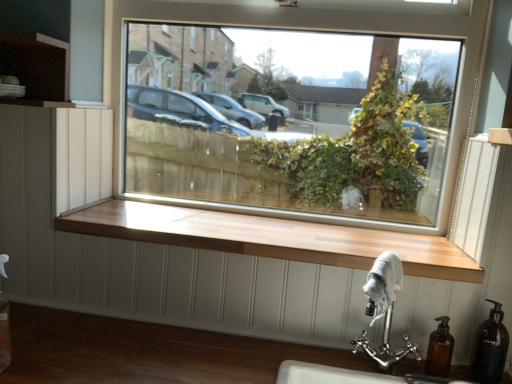
Locate an element on the screen. The height and width of the screenshot is (384, 512). brown matte soap dispenser at lower right, the 2th soap dispenser when ordered from right to left is located at coordinates (439, 350).

At what (x,y) coordinates should I click in order to perform the action: click on polished chrome sink at lower right. Please return your answer as a coordinate pair (x, y). Looking at the image, I should click on (384, 310).

In order to face transparent glass window at center, should I rotate leftwards or rightwards?

You should rotate right by 3.357 degrees.

Where is `wooden at center`? This screenshot has height=384, width=512. wooden at center is located at coordinates (269, 237).

Find the location of a particular element. The height and width of the screenshot is (384, 512). brown matte soap dispenser at lower right, the 1th soap dispenser positioned from the left is located at coordinates (439, 350).

Is wooden at center positioned before transparent glass window at center?

Yes, it is in front of transparent glass window at center.

Considering the positions of points (70, 232) and (464, 55), is point (70, 232) farther from camera compared to point (464, 55)?

No, it is not.

Is wooden at center oriented towards transparent glass window at center?

No, wooden at center is not facing towards transparent glass window at center.

From the image's perspective, is translucent brown soap dispenser at lower right, which is the first soap dispenser in right-to-left order, on wooden at center?

Incorrect, from the image's perspective, translucent brown soap dispenser at lower right, which is the first soap dispenser in right-to-left order, is lower than wooden at center.

From a real-world perspective, is translucent brown soap dispenser at lower right, the second soap dispenser from the left, physically below wooden at center?

Correct, in the physical world, translucent brown soap dispenser at lower right, the second soap dispenser from the left, is lower than wooden at center.

Would you consider translucent brown soap dispenser at lower right, the second soap dispenser from the left, to be distant from wooden at center?

translucent brown soap dispenser at lower right, the second soap dispenser from the left, is near wooden at center, not far away.

From the picture: How far apart are translucent brown soap dispenser at lower right, the second soap dispenser from the left, and wooden at center?

translucent brown soap dispenser at lower right, the second soap dispenser from the left, is 19.82 inches away from wooden at center.

Is translucent brown soap dispenser at lower right, the second soap dispenser from the left, oriented towards brown matte soap dispenser at lower right, the 2th soap dispenser when ordered from right to left?

No.

From the image's perspective, which one is positioned higher, translucent brown soap dispenser at lower right, which is the first soap dispenser in right-to-left order, or brown matte soap dispenser at lower right, the 1th soap dispenser positioned from the left?

translucent brown soap dispenser at lower right, which is the first soap dispenser in right-to-left order, appears higher in the image.

Based on the photo, considering the relative sizes of translucent brown soap dispenser at lower right, which is the first soap dispenser in right-to-left order, and brown matte soap dispenser at lower right, the 2th soap dispenser when ordered from right to left, in the image provided, is translucent brown soap dispenser at lower right, which is the first soap dispenser in right-to-left order, thinner than brown matte soap dispenser at lower right, the 2th soap dispenser when ordered from right to left,?

No.

How far apart are translucent brown soap dispenser at lower right, the second soap dispenser from the left, and brown matte soap dispenser at lower right, the 1th soap dispenser positioned from the left?

translucent brown soap dispenser at lower right, the second soap dispenser from the left, and brown matte soap dispenser at lower right, the 1th soap dispenser positioned from the left, are 4.37 inches apart.

Is there a large distance between polished chrome sink at lower right and brown matte soap dispenser at lower right, the 1th soap dispenser positioned from the left?

No, polished chrome sink at lower right is in close proximity to brown matte soap dispenser at lower right, the 1th soap dispenser positioned from the left.

Does polished chrome sink at lower right contain brown matte soap dispenser at lower right, the 2th soap dispenser when ordered from right to left?

No, brown matte soap dispenser at lower right, the 2th soap dispenser when ordered from right to left, is not a part of polished chrome sink at lower right.

Looking at this image, considering the relative sizes of polished chrome sink at lower right and brown matte soap dispenser at lower right, the 2th soap dispenser when ordered from right to left, in the image provided, is polished chrome sink at lower right shorter than brown matte soap dispenser at lower right, the 2th soap dispenser when ordered from right to left,?

Incorrect, the height of polished chrome sink at lower right does not fall short of that of brown matte soap dispenser at lower right, the 2th soap dispenser when ordered from right to left.

How different are the orientations of polished chrome sink at lower right and brown matte soap dispenser at lower right, the 1th soap dispenser positioned from the left, in degrees?

polished chrome sink at lower right and brown matte soap dispenser at lower right, the 1th soap dispenser positioned from the left, are facing 1.78 degrees away from each other.

From a real-world perspective, is translucent brown soap dispenser at lower right, which is the first soap dispenser in right-to-left order, above or below polished chrome sink at lower right?

Clearly, from a real-world perspective, translucent brown soap dispenser at lower right, which is the first soap dispenser in right-to-left order, is below polished chrome sink at lower right.

Is translucent brown soap dispenser at lower right, which is the first soap dispenser in right-to-left order, not near polished chrome sink at lower right?

No, translucent brown soap dispenser at lower right, which is the first soap dispenser in right-to-left order, is in close proximity to polished chrome sink at lower right.

Find the location of a particular element. The height and width of the screenshot is (384, 512). the 1st soap dispenser positioned below the polished chrome sink at lower right (from a real-world perspective) is located at coordinates (490, 348).

Choose the correct answer: Is translucent brown soap dispenser at lower right, the second soap dispenser from the left, inside polished chrome sink at lower right or outside it?

translucent brown soap dispenser at lower right, the second soap dispenser from the left, exists outside the volume of polished chrome sink at lower right.

Does brown matte soap dispenser at lower right, the 2th soap dispenser when ordered from right to left, have a greater height compared to polished chrome sink at lower right?

No.

From a real-world perspective, relative to polished chrome sink at lower right, is brown matte soap dispenser at lower right, the 1th soap dispenser positioned from the left, vertically above or below?

From a real-world perspective, brown matte soap dispenser at lower right, the 1th soap dispenser positioned from the left, is physically below polished chrome sink at lower right.

Which is more to the right, brown matte soap dispenser at lower right, the 1th soap dispenser positioned from the left, or polished chrome sink at lower right?

From the viewer's perspective, brown matte soap dispenser at lower right, the 1th soap dispenser positioned from the left, appears more on the right side.

Between brown matte soap dispenser at lower right, the 1th soap dispenser positioned from the left, and polished chrome sink at lower right, which one has larger width?

polished chrome sink at lower right is wider.

From the image's perspective, which one is positioned higher, transparent glass window at center or wooden at center?

transparent glass window at center.

Can you confirm if transparent glass window at center is smaller than wooden at center?

Actually, transparent glass window at center might be larger than wooden at center.

At what (x,y) coordinates should I click in order to perform the action: click on window above the wooden at center (from the image's perspective). Please return your answer as a coordinate pair (x, y). This screenshot has width=512, height=384. Looking at the image, I should click on (292, 95).

Based on the photo, is transparent glass window at center completely or partially outside of wooden at center?

Yes.

At what (x,y) coordinates should I click in order to perform the action: click on window sill below the transparent glass window at center (from a real-world perspective). Please return your answer as a coordinate pair (x, y). The width and height of the screenshot is (512, 384). Looking at the image, I should click on (269, 237).

At what (x,y) coordinates should I click in order to perform the action: click on soap dispenser that is the 2nd object to the right of the wooden at center, starting at the anchor. Please return your answer as a coordinate pair (x, y). Looking at the image, I should click on (490, 348).

From the image, which object appears to be nearer to transparent glass window at center, translucent brown soap dispenser at lower right, the second soap dispenser from the left, or brown matte soap dispenser at lower right, the 1th soap dispenser positioned from the left?

translucent brown soap dispenser at lower right, the second soap dispenser from the left.

Looking at the image, which one is located closer to transparent glass window at center, wooden at center or brown matte soap dispenser at lower right, the 2th soap dispenser when ordered from right to left?

Among the two, wooden at center is located nearer to transparent glass window at center.

Which object lies further to the anchor point brown matte soap dispenser at lower right, the 2th soap dispenser when ordered from right to left, wooden at center or polished chrome sink at lower right?

wooden at center is further to brown matte soap dispenser at lower right, the 2th soap dispenser when ordered from right to left.

Based on their spatial positions, is translucent brown soap dispenser at lower right, which is the first soap dispenser in right-to-left order, or wooden at center closer to polished chrome sink at lower right?

Based on the image, translucent brown soap dispenser at lower right, which is the first soap dispenser in right-to-left order, appears to be nearer to polished chrome sink at lower right.

Looking at the image, which one is located further to wooden at center, brown matte soap dispenser at lower right, the 2th soap dispenser when ordered from right to left, or translucent brown soap dispenser at lower right, which is the first soap dispenser in right-to-left order?

Based on the image, translucent brown soap dispenser at lower right, which is the first soap dispenser in right-to-left order, appears to be further to wooden at center.

Considering their positions, is brown matte soap dispenser at lower right, the 1th soap dispenser positioned from the left, positioned closer to polished chrome sink at lower right than transparent glass window at center?

Among the two, brown matte soap dispenser at lower right, the 1th soap dispenser positioned from the left, is located nearer to polished chrome sink at lower right.

When comparing their distances from brown matte soap dispenser at lower right, the 2th soap dispenser when ordered from right to left, does transparent glass window at center or polished chrome sink at lower right seem closer?

polished chrome sink at lower right is positioned closer to the anchor brown matte soap dispenser at lower right, the 2th soap dispenser when ordered from right to left.

When comparing their distances from transparent glass window at center, does polished chrome sink at lower right or translucent brown soap dispenser at lower right, which is the first soap dispenser in right-to-left order, seem further?

Based on the image, translucent brown soap dispenser at lower right, which is the first soap dispenser in right-to-left order, appears to be further to transparent glass window at center.

You are a GUI agent. You are given a task and a screenshot of the screen. Output one action in this format:
    pyautogui.click(x=<x>, y=<y>)
    Task: Click on the sink between wooden at center and brown matte soap dispenser at lower right, the 1th soap dispenser positioned from the left, in the horizontal direction
    This screenshot has height=384, width=512.
    Given the screenshot: What is the action you would take?
    pyautogui.click(x=384, y=310)

What are the coordinates of `sink between wooden at center and translucent brown soap dispenser at lower right, the second soap dispenser from the left` in the screenshot? It's located at (384, 310).

The image size is (512, 384). In order to click on soap dispenser between transparent glass window at center and brown matte soap dispenser at lower right, the 1th soap dispenser positioned from the left, in the vertical direction in this screenshot , I will do `click(490, 348)`.

At what (x,y) coordinates should I click in order to perform the action: click on window sill between transparent glass window at center and translucent brown soap dispenser at lower right, the second soap dispenser from the left, in the up-down direction. Please return your answer as a coordinate pair (x, y). Looking at the image, I should click on (269, 237).